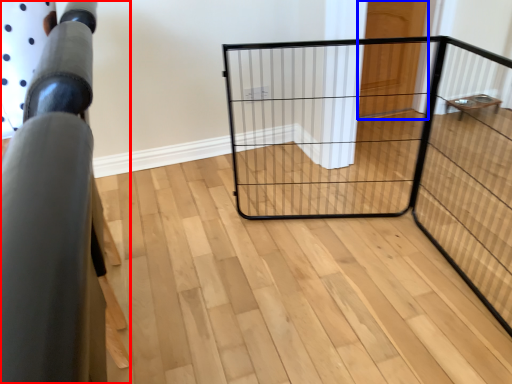
Question: Which point is closer to the camera, furniture (highlighted by a red box) or door (highlighted by a blue box)?

Choices:
 (A) furniture
 (B) door

Answer: (A)